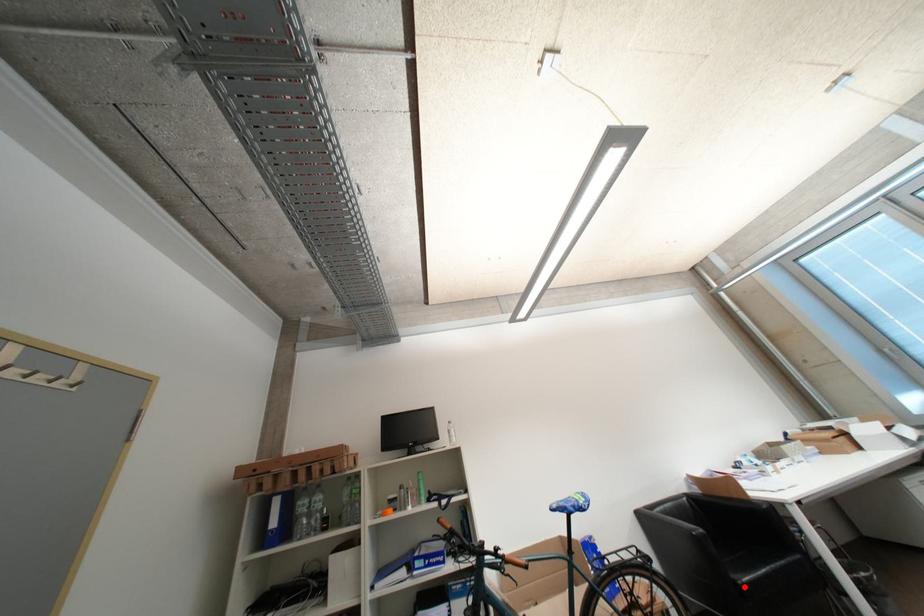
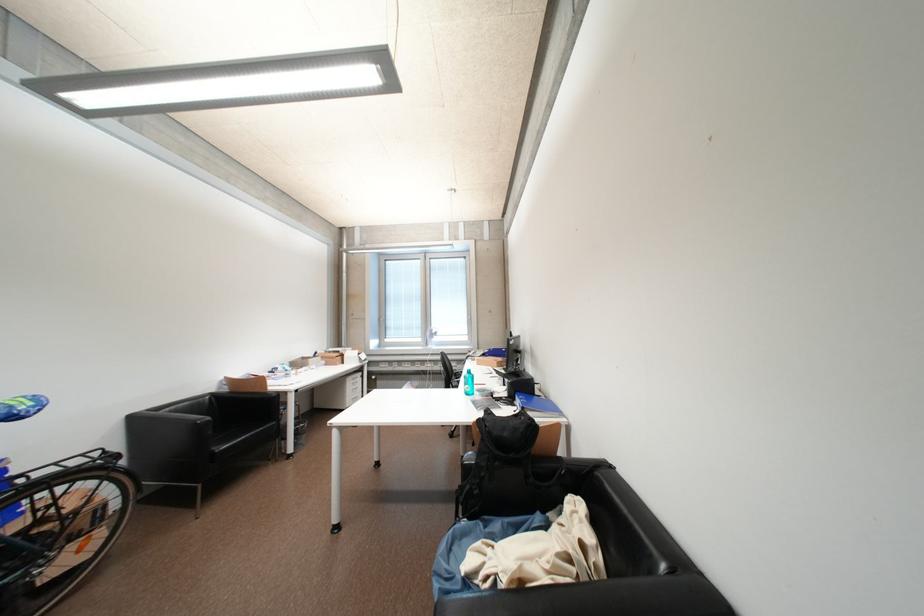
Locate, in the second image, the point that corresponds to the highlighted location in the first image.

(221, 456)